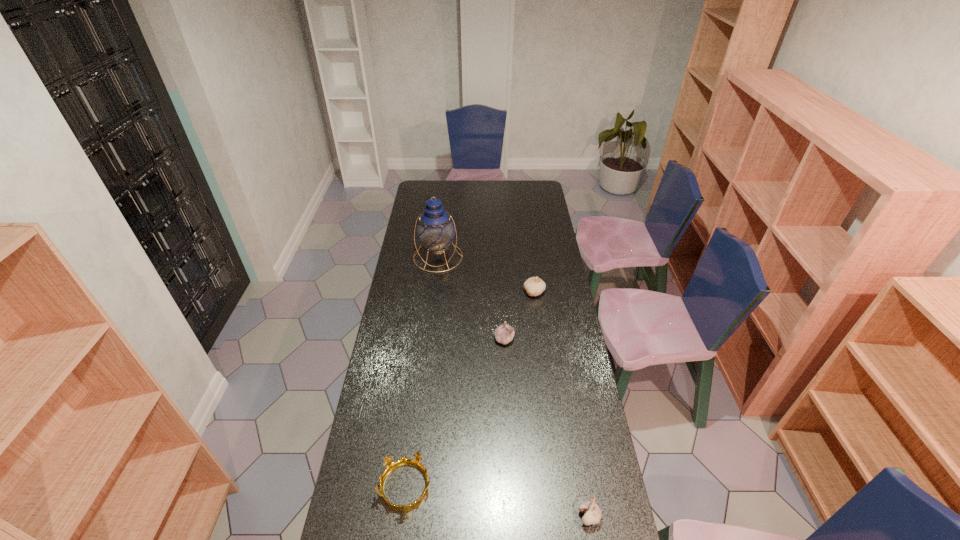
This screenshot has height=540, width=960. Identify the location of vacant space located on the left of the farthest garlic. (451, 292).

Where is `free space located on the back of the nearest garlic`? The height and width of the screenshot is (540, 960). free space located on the back of the nearest garlic is located at coordinates (573, 423).

Where is `free region located 0.170m on the back of the crown`? The width and height of the screenshot is (960, 540). free region located 0.170m on the back of the crown is located at coordinates (415, 414).

Where is `lantern that is positioned at the left edge`? The width and height of the screenshot is (960, 540). lantern that is positioned at the left edge is located at coordinates (435, 229).

This screenshot has height=540, width=960. I want to click on crown that is at the left edge, so click(391, 466).

Where is `vacant space at the far edge of the desktop`? vacant space at the far edge of the desktop is located at coordinates (472, 194).

Where is `vacant space at the left edge`? This screenshot has height=540, width=960. vacant space at the left edge is located at coordinates (408, 216).

You are a GUI agent. You are given a task and a screenshot of the screen. Output one action in this format:
    pyautogui.click(x=<x>, y=<y>)
    Task: Click on the free region at the right edge of the desktop
    
    Given the screenshot: What is the action you would take?
    (600, 510)

Identify the location of vacant space at the far right corner of the desktop. (539, 200).

At what (x,y) coordinates should I click in order to perform the action: click on empty space between the crown and the lantern. Please return your answer as a coordinate pair (x, y). Looking at the image, I should click on (421, 372).